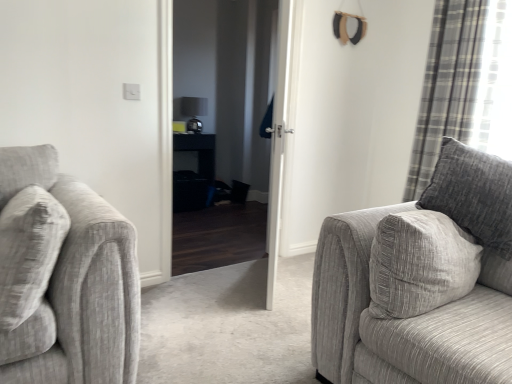
Locate an element on the screen. white glossy door at center is located at coordinates (279, 142).

Measure the distance between black glossy door at center and camera.

black glossy door at center and camera are 4.26 meters apart from each other.

In order to face black glossy table at center, should I rotate leftwards or rightwards?

Rotate your view left by about 9.374°.

I want to click on textured gray couch at right, so click(x=420, y=282).

Would you say textured gray couch at right contains black glossy table at center?

No, black glossy table at center is not a part of textured gray couch at right.

Are textured gray couch at right and black glossy table at center located far from each other?

Yes, textured gray couch at right is far from black glossy table at center.

In order to click on studio couch in front of the black glossy table at center in this screenshot , I will do `click(420, 282)`.

Is textured gray couch at right taller or shorter than black glossy table at center?

Clearly, textured gray couch at right is taller compared to black glossy table at center.

Which object is further away from the camera, black glossy table at center or textured gray couch at right?

black glossy table at center is further away from the camera.

How far apart are black glossy table at center and textured gray couch at right?

black glossy table at center and textured gray couch at right are 2.98 meters apart.

Considering the positions of points (208, 137) and (334, 344), is point (208, 137) farther from camera compared to point (334, 344)?

Yes, point (208, 137) is farther from viewer.

Based on their positions, is black glossy table at center located to the left or right of textured gray couch at right?

In the image, black glossy table at center appears on the left side of textured gray couch at right.

How different are the orientations of black glossy door at center and white glossy door at center in degrees?

The angular difference between black glossy door at center and white glossy door at center is 129 degrees.

Is black glossy door at center outside of white glossy door at center?

Absolutely, black glossy door at center is external to white glossy door at center.

In terms of height, does black glossy door at center look taller or shorter compared to white glossy door at center?

In the image, black glossy door at center appears to be taller than white glossy door at center.

Consider the image. Between black glossy door at center and white glossy door at center, which one has larger size?

With larger size is black glossy door at center.

Does black glossy table at center have a larger size compared to plaid fabric curtain at right?

No, black glossy table at center is not bigger than plaid fabric curtain at right.

Which is more to the right, black glossy table at center or plaid fabric curtain at right?

Positioned to the right is plaid fabric curtain at right.

Find the location of a particular element. The width and height of the screenshot is (512, 384). curtain above the black glossy table at center (from a real-world perspective) is located at coordinates (447, 85).

In the scene shown: Choose the correct answer: Is black glossy table at center inside plaid fabric curtain at right or outside it?

black glossy table at center exists outside the volume of plaid fabric curtain at right.

Considering the relative positions of white glossy door at center and black glossy door at center in the image provided, is white glossy door at center to the right of black glossy door at center from the viewer's perspective?

Indeed, white glossy door at center is positioned on the right side of black glossy door at center.

Is white glossy door at center looking in the opposite direction of black glossy door at center?

Yes.

Choose the correct answer: Is white glossy door at center inside black glossy door at center or outside it?

white glossy door at center is not enclosed by black glossy door at center.

Consider the image. Can you tell me how much white glossy door at center and black glossy door at center differ in facing direction?

The angle between the facing direction of white glossy door at center and the facing direction of black glossy door at center is 129 degrees.

Can you confirm if textured gray couch at right is thinner than plaid fabric curtain at right?

In fact, textured gray couch at right might be wider than plaid fabric curtain at right.

Is plaid fabric curtain at right completely or partially inside textured gray couch at right?

That's incorrect, plaid fabric curtain at right is not inside textured gray couch at right.

Considering the relative sizes of textured gray couch at right and plaid fabric curtain at right in the image provided, is textured gray couch at right bigger than plaid fabric curtain at right?

Yes.

Considering the relative positions of textured gray couch at right and plaid fabric curtain at right in the image provided, is textured gray couch at right behind plaid fabric curtain at right?

No, textured gray couch at right is closer to the camera.

From the image's perspective, relative to plaid fabric curtain at right, is black glossy door at center above or below?

black glossy door at center is below plaid fabric curtain at right.

From a real-world perspective, who is located lower, black glossy door at center or plaid fabric curtain at right?

black glossy door at center.

Is black glossy door at center positioned with its back to plaid fabric curtain at right?

No, black glossy door at center is not facing the opposite direction of plaid fabric curtain at right.

Is black glossy door at center shorter than plaid fabric curtain at right?

In fact, black glossy door at center may be taller than plaid fabric curtain at right.

This screenshot has width=512, height=384. Find the location of `studio couch above the black glossy table at center (from a real-world perspective)`. studio couch above the black glossy table at center (from a real-world perspective) is located at coordinates (420, 282).

Image resolution: width=512 pixels, height=384 pixels. Identify the location of studio couch lying in front of the black glossy table at center. (420, 282).

Estimate the real-world distances between objects in this image. Which object is further from black glossy table at center, plaid fabric curtain at right or white glossy door at center?

A: plaid fabric curtain at right is further to black glossy table at center.

Looking at the image, which one is located closer to plaid fabric curtain at right, black glossy table at center or black glossy door at center?

Among the two, black glossy door at center is located nearer to plaid fabric curtain at right.

Considering their positions, is black glossy table at center positioned closer to white glossy door at center than textured gray couch at right?

Among the two, textured gray couch at right is located nearer to white glossy door at center.

When comparing their distances from white glossy door at center, does textured gray couch at right or black glossy door at center seem closer?

textured gray couch at right.

Considering their positions, is black glossy door at center positioned closer to black glossy table at center than white glossy door at center?

black glossy door at center lies closer to black glossy table at center than the other object.

Based on their spatial positions, is textured gray couch at right or black glossy table at center closer to plaid fabric curtain at right?

textured gray couch at right.

When comparing their distances from black glossy table at center, does textured gray couch at right or plaid fabric curtain at right seem closer?

Based on the image, plaid fabric curtain at right appears to be nearer to black glossy table at center.

In the scene shown: Considering their positions, is white glossy door at center positioned further to textured gray couch at right than black glossy table at center?

black glossy table at center is positioned further to the anchor textured gray couch at right.

Where is `door between textured gray couch at right and black glossy door at center along the z-axis`? door between textured gray couch at right and black glossy door at center along the z-axis is located at coordinates (279, 142).

I want to click on screen door between textured gray couch at right and black glossy table at center from front to back, so click(239, 92).

Where is `screen door between textured gray couch at right and plaid fabric curtain at right from front to back`? Image resolution: width=512 pixels, height=384 pixels. screen door between textured gray couch at right and plaid fabric curtain at right from front to back is located at coordinates (239, 92).

The width and height of the screenshot is (512, 384). Find the location of `door between textured gray couch at right and black glossy table at center along the z-axis`. door between textured gray couch at right and black glossy table at center along the z-axis is located at coordinates (279, 142).